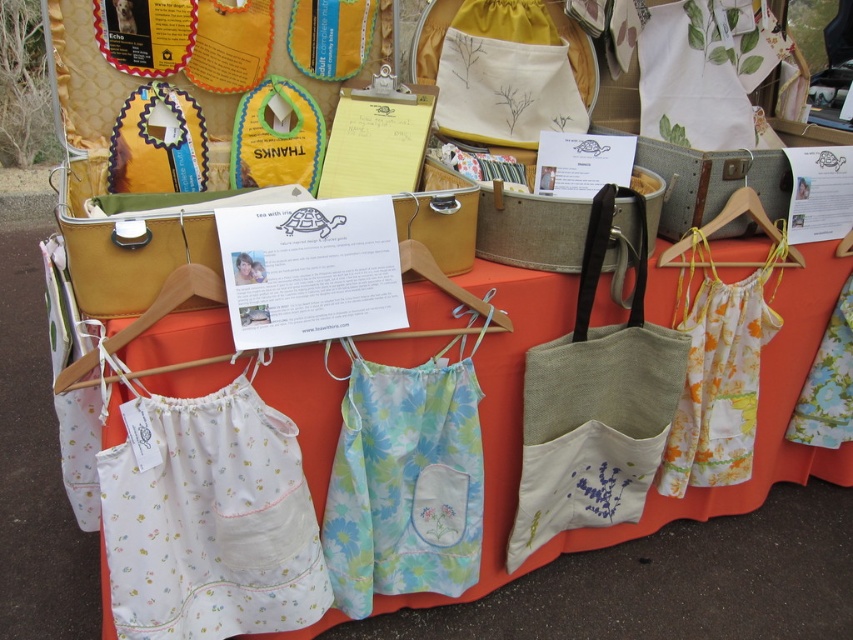
You are organizing a craft fair booth and need to arrange items efficiently. You have a white cotton apron at lower left and a natural linen tote at center. Which item requires more space to display?

The natural linen tote at center requires more space because the white cotton apron at lower left occupies less space than it.

You are a customer at the craft fair and you want to pick up the natural linen tote at center. Is the white cotton apron at lower left blocking your access to it?

The white cotton apron at lower left is in front of the natural linen tote at center, so it is blocking access to the tote. You would need to move the apron to reach the tote.